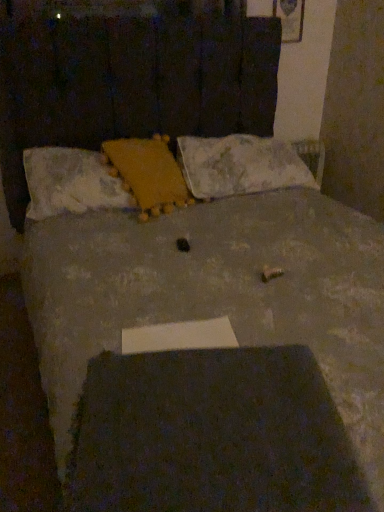
Question: Considering the relative sizes of fluffy white pillow at upper left, placed as the third pillow when sorted from right to left, and yellow fuzzy pillow at upper center, placed as the 2th pillow when sorted from right to left, in the image provided, is fluffy white pillow at upper left, placed as the third pillow when sorted from right to left, wider than yellow fuzzy pillow at upper center, placed as the 2th pillow when sorted from right to left,?

Choices:
 (A) no
 (B) yes

Answer: (A)

Question: Is fluffy white pillow at upper left, which is the first pillow in left-to-right order, to the right of yellow fuzzy pillow at upper center, acting as the second pillow starting from the left, from the viewer's perspective?

Choices:
 (A) yes
 (B) no

Answer: (B)

Question: Is there a large distance between fluffy white pillow at upper left, placed as the third pillow when sorted from right to left, and yellow fuzzy pillow at upper center, placed as the 2th pillow when sorted from right to left?

Choices:
 (A) yes
 (B) no

Answer: (B)

Question: Is fluffy white pillow at upper left, which is the first pillow in left-to-right order, positioned behind yellow fuzzy pillow at upper center, acting as the second pillow starting from the left?

Choices:
 (A) no
 (B) yes

Answer: (A)

Question: From a real-world perspective, is fluffy white pillow at upper left, which is the first pillow in left-to-right order, located higher than yellow fuzzy pillow at upper center, placed as the 2th pillow when sorted from right to left?

Choices:
 (A) no
 (B) yes

Answer: (A)

Question: Considering the positions of yellow fuzzy pillow at upper center, placed as the 2th pillow when sorted from right to left, and fluffy white pillow at upper left, placed as the third pillow when sorted from right to left, in the image, is yellow fuzzy pillow at upper center, placed as the 2th pillow when sorted from right to left, taller or shorter than fluffy white pillow at upper left, placed as the third pillow when sorted from right to left,?

Choices:
 (A) tall
 (B) short

Answer: (A)

Question: Does point (160, 164) appear closer or farther from the camera than point (34, 200)?

Choices:
 (A) closer
 (B) farther

Answer: (B)

Question: From the image's perspective, is yellow fuzzy pillow at upper center, placed as the 2th pillow when sorted from right to left, located above or below fluffy white pillow at upper left, which is the first pillow in left-to-right order?

Choices:
 (A) below
 (B) above

Answer: (B)

Question: Is yellow fuzzy pillow at upper center, acting as the second pillow starting from the left, situated inside fluffy white pillow at upper left, which is the first pillow in left-to-right order, or outside?

Choices:
 (A) outside
 (B) inside

Answer: (B)

Question: From a real-world perspective, is fluffy white pillow at upper left, which is the first pillow in left-to-right order, above or below white soft pillow at center, the 3th pillow when ordered from left to right?

Choices:
 (A) above
 (B) below

Answer: (A)

Question: From the image's perspective, is fluffy white pillow at upper left, placed as the third pillow when sorted from right to left, above or below white soft pillow at center, the 3th pillow when ordered from left to right?

Choices:
 (A) above
 (B) below

Answer: (B)

Question: Looking at their shapes, would you say fluffy white pillow at upper left, which is the first pillow in left-to-right order, is wider or thinner than white soft pillow at center, the 1th pillow in the right-to-left sequence?

Choices:
 (A) thin
 (B) wide

Answer: (A)

Question: Is fluffy white pillow at upper left, which is the first pillow in left-to-right order, inside the boundaries of white soft pillow at center, the 3th pillow when ordered from left to right, or outside?

Choices:
 (A) outside
 (B) inside

Answer: (A)

Question: From a real-world perspective, is yellow fuzzy pillow at upper center, placed as the 2th pillow when sorted from right to left, physically located above or below white soft pillow at center, the 1th pillow in the right-to-left sequence?

Choices:
 (A) below
 (B) above

Answer: (B)

Question: Considering their positions, is yellow fuzzy pillow at upper center, acting as the second pillow starting from the left, located in front of or behind white soft pillow at center, the 1th pillow in the right-to-left sequence?

Choices:
 (A) behind
 (B) front

Answer: (B)